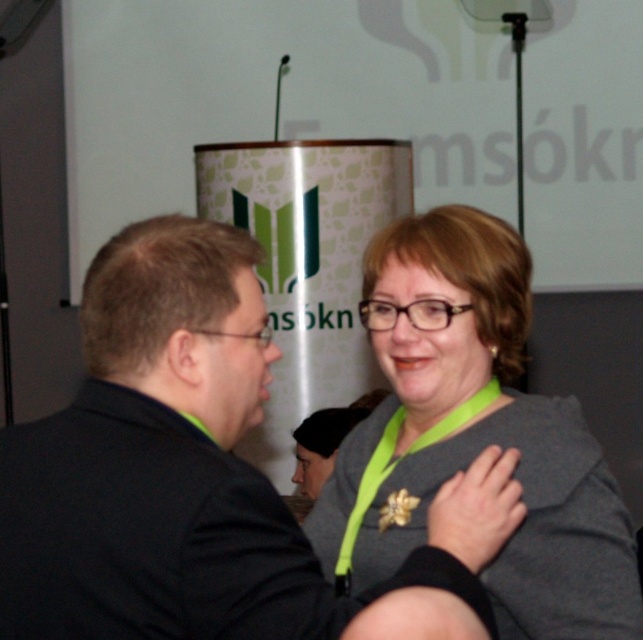
You are attending a formal event and need to determine the position of two attendees wearing formal attire. According to the image, which one is positioned higher between the black matte suit at center and the gray matte jacket at center?

The black matte suit at center is positioned higher than the gray matte jacket at center, as it is located above it in the image.

You are at an event and need to approach the person wearing the black matte suit at center. The gray matte jacket at center is blocking your path. Can you walk around them to reach the person?

The black matte suit at center is in front of the gray matte jacket at center, so the gray matte jacket at center is behind the black matte suit at center. Therefore, you can walk around the gray matte jacket at center to reach the black matte suit at center.